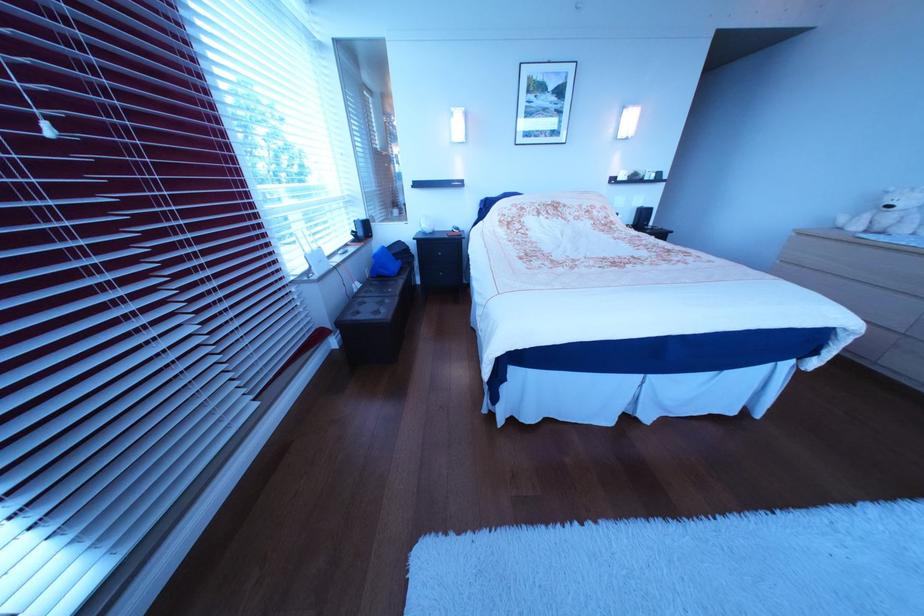
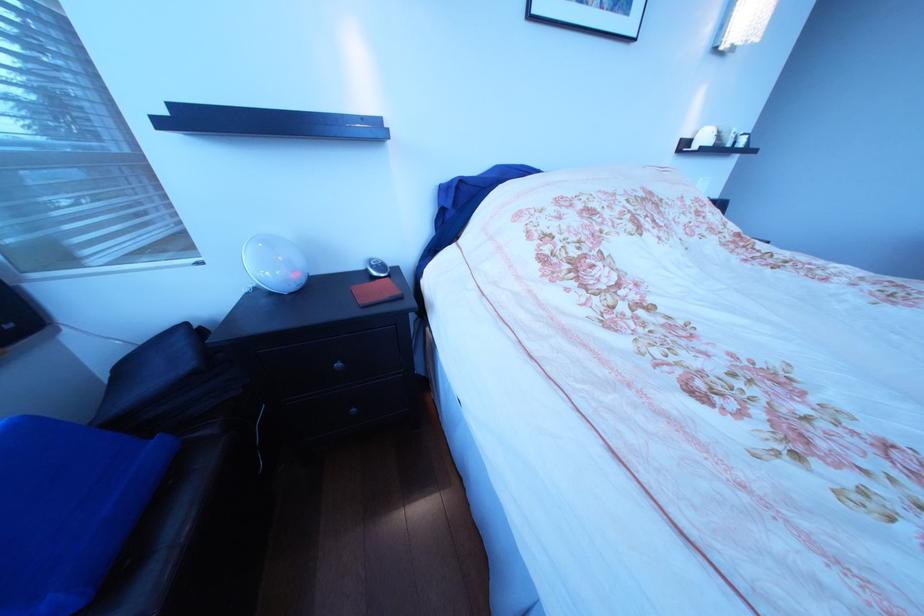
In the second image, find the point that corresponds to (x=435, y=233) in the first image.

(272, 291)